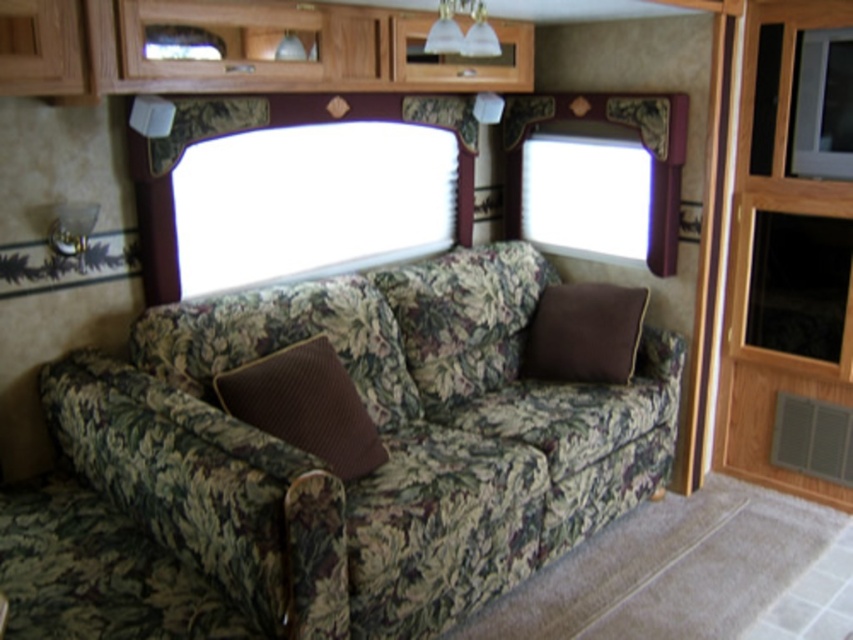
Can you confirm if floral fabric couch at center is taller than brown cotton pillow at center?

Yes.

Is point (271, 528) positioned behind point (560, 333)?

No, (271, 528) is closer to viewer.

Between point (459, 289) and point (569, 330), which one is positioned behind?

Point (569, 330)

Find the location of a particular element. This screenshot has width=853, height=640. floral fabric couch at center is located at coordinates (378, 436).

Can you confirm if floral fabric couch at center is smaller than brown textured pillow at center?

No, floral fabric couch at center is not smaller than brown textured pillow at center.

Which is in front, point (387, 515) or point (314, 372)?

Point (387, 515)

You are a GUI agent. You are given a task and a screenshot of the screen. Output one action in this format:
    pyautogui.click(x=<x>, y=<y>)
    Task: Click on the floral fabric couch at center
    Image resolution: width=853 pixels, height=640 pixels.
    Given the screenshot: What is the action you would take?
    pyautogui.click(x=378, y=436)

Between brown textured pillow at center and brown cotton pillow at center, which one is positioned lower?

Positioned lower is brown textured pillow at center.

Looking at this image, can you confirm if brown textured pillow at center is positioned below brown cotton pillow at center?

Yes, brown textured pillow at center is below brown cotton pillow at center.

Which is behind, point (234, 385) or point (550, 304)?

Point (550, 304)

Where is `brown textured pillow at center`? The width and height of the screenshot is (853, 640). brown textured pillow at center is located at coordinates (305, 404).